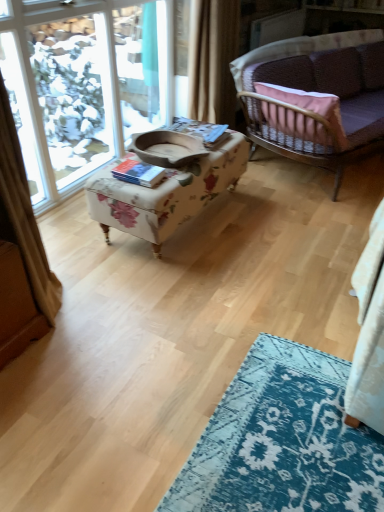
Where is `clear glass window at upper left`? clear glass window at upper left is located at coordinates point(82,84).

What do you see at coordinates (82, 84) in the screenshot? The width and height of the screenshot is (384, 512). I see `clear glass window at upper left` at bounding box center [82, 84].

This screenshot has height=512, width=384. What are the coordinates of `floral fabric ottoman at center` in the screenshot? It's located at (166, 193).

Describe the element at coordinates (321, 95) in the screenshot. I see `velvet purple couch at upper right` at that location.

This screenshot has width=384, height=512. Find the location of `clear glass window at upper left`. clear glass window at upper left is located at coordinates (82, 84).

Is the depth of velvet purple couch at upper right greater than that of clear glass window at upper left?

That is True.

Could you tell me if velvet purple couch at upper right is turned towards clear glass window at upper left?

No, velvet purple couch at upper right is not oriented towards clear glass window at upper left.

In the scene shown: Considering the positions of objects velvet purple couch at upper right and clear glass window at upper left in the image provided, who is more to the right, velvet purple couch at upper right or clear glass window at upper left?

velvet purple couch at upper right.

How different are the orientations of velvet purple couch at upper right and clear glass window at upper left in degrees?

22.9 degrees.

Which of these two, floral fabric ottoman at center or clear glass window at upper left, is wider?

floral fabric ottoman at center.

Is floral fabric ottoman at center facing away from clear glass window at upper left?

Yes, clear glass window at upper left is at the back of floral fabric ottoman at center.

Between point (169, 224) and point (111, 42), which one is positioned in front?

The point (169, 224) is closer.

Would you say floral fabric ottoman at center is a long distance from clear glass window at upper left?

floral fabric ottoman at center is positioned a significant distance from clear glass window at upper left.

From the image's perspective, which is above, velvet purple couch at upper right or beige fabric curtain at upper center?

From the image's view, beige fabric curtain at upper center is above.

Is beige fabric curtain at upper center at the back of velvet purple couch at upper right?

That's right, velvet purple couch at upper right is facing away from beige fabric curtain at upper center.

Is velvet purple couch at upper right in contact with beige fabric curtain at upper center?

velvet purple couch at upper right and beige fabric curtain at upper center are not in contact.

Is velvet purple couch at upper right at the right side of beige fabric curtain at upper center?

Yes.

Does point (188, 111) come in front of point (135, 17)?

Yes, it is.

Is beige fabric curtain at upper center facing away from clear glass window at upper left?

Correct, beige fabric curtain at upper center is looking away from clear glass window at upper left.

From a real-world perspective, is beige fabric curtain at upper center above or below clear glass window at upper left?

beige fabric curtain at upper center is above clear glass window at upper left.

Is velvet purple couch at upper right turned away from floral fabric ottoman at center?

No, floral fabric ottoman at center is not at the back of velvet purple couch at upper right.

Does velvet purple couch at upper right have a lesser width compared to floral fabric ottoman at center?

No.

Between point (355, 120) and point (108, 178), which one is positioned behind?

The point (355, 120) is more distant.

Is clear glass window at upper left taller or shorter than velvet purple couch at upper right?

Clearly, clear glass window at upper left is taller compared to velvet purple couch at upper right.

Does point (166, 25) appear closer or farther from the camera than point (298, 155)?

Point (166, 25).

Could you tell me if clear glass window at upper left is facing velvet purple couch at upper right?

Yes, clear glass window at upper left is facing velvet purple couch at upper right.

Between clear glass window at upper left and velvet purple couch at upper right, which one appears on the left side from the viewer's perspective?

clear glass window at upper left is more to the left.

Which is in front, point (217, 55) or point (381, 117)?

Point (217, 55)

How distant is beige fabric curtain at upper center from velvet purple couch at upper right?

beige fabric curtain at upper center is 20.45 inches from velvet purple couch at upper right.

Is beige fabric curtain at upper center taller than velvet purple couch at upper right?

Yes.

From the image's perspective, which is above, beige fabric curtain at upper center or velvet purple couch at upper right?

beige fabric curtain at upper center is shown above in the image.

Find the location of a particular element. The width and height of the screenshot is (384, 512). window that appears above the velvet purple couch at upper right (from a real-world perspective) is located at coordinates coord(82,84).

The image size is (384, 512). Find the location of `table on the right of clear glass window at upper left`. table on the right of clear glass window at upper left is located at coordinates [166, 193].

Estimate the real-world distances between objects in this image. Which object is further from floral fabric ottoman at center, beige fabric curtain at upper center or clear glass window at upper left?

Based on the image, clear glass window at upper left appears to be further to floral fabric ottoman at center.

From the image, which object appears to be nearer to clear glass window at upper left, floral fabric ottoman at center or velvet purple couch at upper right?

Based on the image, floral fabric ottoman at center appears to be nearer to clear glass window at upper left.

When comparing their distances from floral fabric ottoman at center, does clear glass window at upper left or beige fabric curtain at upper center seem further?

clear glass window at upper left.

Based on their spatial positions, is beige fabric curtain at upper center or velvet purple couch at upper right closer to floral fabric ottoman at center?

Among the two, beige fabric curtain at upper center is located nearer to floral fabric ottoman at center.

From the image, which object appears to be nearer to velvet purple couch at upper right, floral fabric ottoman at center or beige fabric curtain at upper center?

beige fabric curtain at upper center is closer to velvet purple couch at upper right.

Based on their spatial positions, is clear glass window at upper left or beige fabric curtain at upper center further from velvet purple couch at upper right?

Based on the image, clear glass window at upper left appears to be further to velvet purple couch at upper right.

Estimate the real-world distances between objects in this image. Which object is further from velvet purple couch at upper right, floral fabric ottoman at center or clear glass window at upper left?

Among the two, clear glass window at upper left is located further to velvet purple couch at upper right.

Estimate the real-world distances between objects in this image. Which object is closer to velvet purple couch at upper right, clear glass window at upper left or floral fabric ottoman at center?

floral fabric ottoman at center is positioned closer to the anchor velvet purple couch at upper right.

The height and width of the screenshot is (512, 384). What are the coordinates of `curtain between floral fabric ottoman at center and velvet purple couch at upper right in the horizontal direction` in the screenshot? It's located at (212, 60).

You are a GUI agent. You are given a task and a screenshot of the screen. Output one action in this format:
    pyautogui.click(x=<x>, y=<y>)
    Task: Click on the curtain located between clear glass window at upper left and velvet purple couch at upper right in the left-right direction
    
    Given the screenshot: What is the action you would take?
    pyautogui.click(x=212, y=60)

In order to click on table located between clear glass window at upper left and velvet purple couch at upper right in the left-right direction in this screenshot , I will do `click(166, 193)`.

Where is `window between beige fabric curtain at upper center and floral fabric ottoman at center in the up-down direction`? The width and height of the screenshot is (384, 512). window between beige fabric curtain at upper center and floral fabric ottoman at center in the up-down direction is located at coordinates (82, 84).